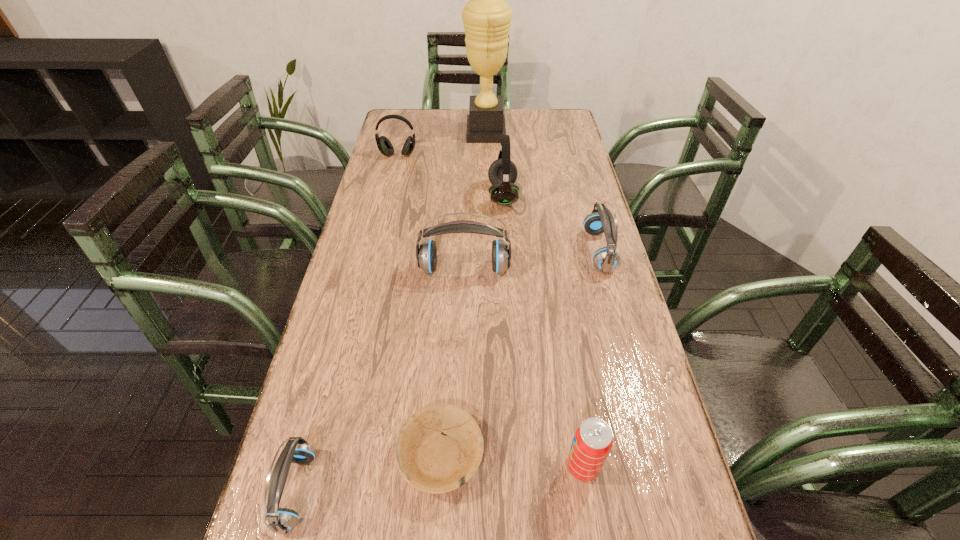
Locate an element on the screen. vacant space at the far edge of the desktop is located at coordinates (458, 126).

Image resolution: width=960 pixels, height=540 pixels. Find the location of `vacant space at the left edge of the desktop`. vacant space at the left edge of the desktop is located at coordinates (377, 328).

The height and width of the screenshot is (540, 960). Find the location of `vacant space at the right edge of the desktop`. vacant space at the right edge of the desktop is located at coordinates (553, 241).

Locate an element on the screen. The height and width of the screenshot is (540, 960). empty space that is in between the tallest object and the rightmost object is located at coordinates (542, 192).

Find the location of a particular element. This screenshot has width=960, height=540. free space between the farther black headset and the shortest object is located at coordinates (420, 306).

Locate an element on the screen. The height and width of the screenshot is (540, 960). free spot between the shortest object and the right black headset is located at coordinates (472, 326).

Locate an element on the screen. Image resolution: width=960 pixels, height=540 pixels. free spot between the biggest blue headset and the shortest headset is located at coordinates (380, 380).

Find the location of `empty space between the rightmost object and the soda can`. empty space between the rightmost object and the soda can is located at coordinates (590, 359).

At what (x,y) coordinates should I click in order to perform the action: click on vacant space that's between the trophy cup and the shortest object. Please return your answer as a coordinate pair (x, y). The image size is (960, 540). Looking at the image, I should click on (464, 294).

Where is `free space between the soda can and the farthest headset`? The height and width of the screenshot is (540, 960). free space between the soda can and the farthest headset is located at coordinates (491, 311).